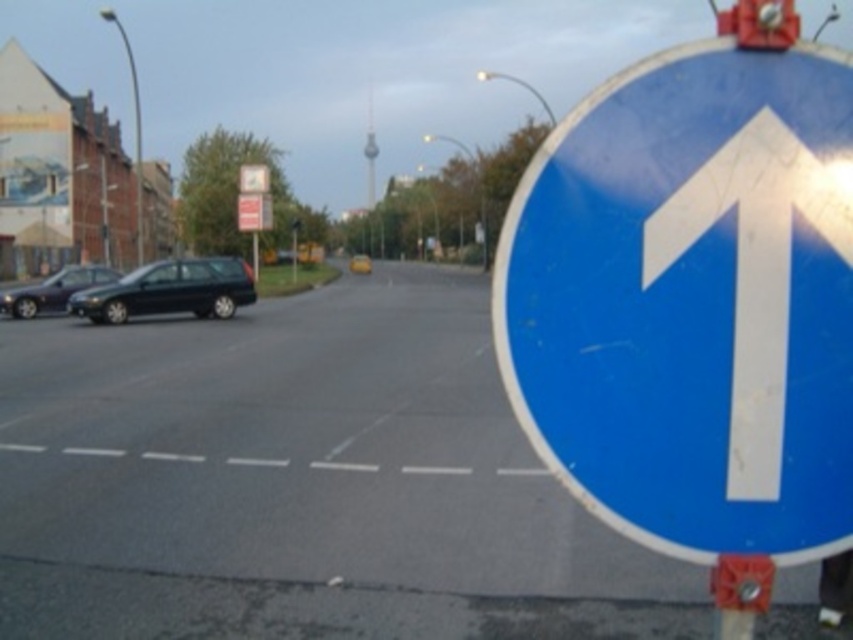
Question: Does shiny dark blue sedan at left appear under matte black car at left?

Choices:
 (A) yes
 (B) no

Answer: (B)

Question: Which object is the farthest from the metallic red traffic light at upper right?

Choices:
 (A) white plastic arrow at upper right
 (B) shiny dark blue sedan at left

Answer: (B)

Question: Which object is farther from the camera taking this photo?

Choices:
 (A) shiny dark blue sedan at left
 (B) metallic red traffic light at upper right

Answer: (A)

Question: In this image, where is blue glossy sign at right located relative to white plastic arrow at upper right?

Choices:
 (A) above
 (B) below

Answer: (B)

Question: Among these points, which one is nearest to the camera?

Choices:
 (A) (776, 324)
 (B) (120, 292)

Answer: (A)

Question: Does white plastic arrow at upper right come in front of shiny dark blue sedan at left?

Choices:
 (A) no
 (B) yes

Answer: (B)